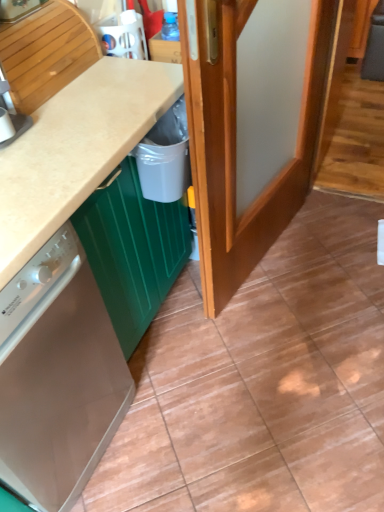
Locate an element on the screen. vacant area located to the right-hand side of wooden door at center is located at coordinates (337, 248).